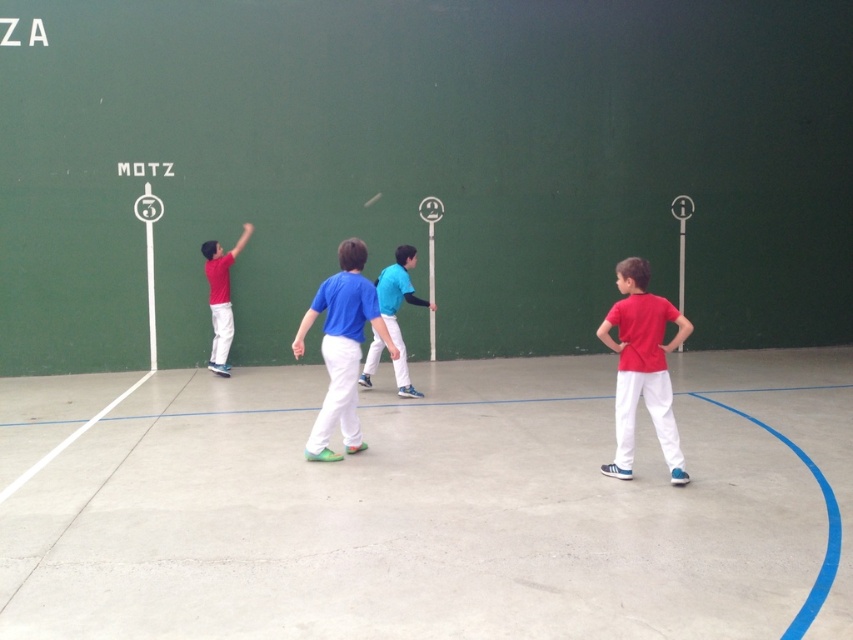
What do you see at coordinates (642, 368) in the screenshot? Image resolution: width=853 pixels, height=640 pixels. I see `matte red shirt at right` at bounding box center [642, 368].

Locate an element on the screen. This screenshot has height=640, width=853. matte red shirt at right is located at coordinates (642, 368).

Identify the location of matte red shirt at right. click(642, 368).

Locate an element on the screen. Image resolution: width=853 pixels, height=640 pixels. matte red shirt at right is located at coordinates (642, 368).

Identify the location of matte red shirt at right. The image size is (853, 640). (642, 368).

Does matte red shirt at right have a lesser height compared to matte red shirt at left?

Indeed, matte red shirt at right has a lesser height compared to matte red shirt at left.

The height and width of the screenshot is (640, 853). What do you see at coordinates (642, 368) in the screenshot?
I see `matte red shirt at right` at bounding box center [642, 368].

Locate an element on the screen. matte red shirt at right is located at coordinates (642, 368).

Who is positioned more to the right, blue cotton shirt at center or blue jersey at center?

From the viewer's perspective, blue jersey at center appears more on the right side.

Is blue cotton shirt at center to the left of blue jersey at center from the viewer's perspective?

Yes, blue cotton shirt at center is to the left of blue jersey at center.

This screenshot has width=853, height=640. Identify the location of blue cotton shirt at center. (341, 348).